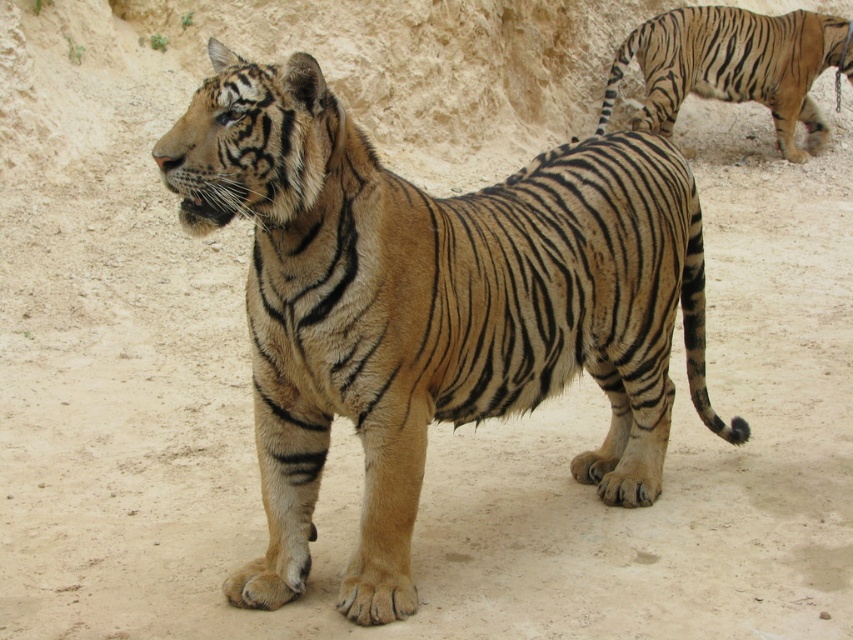
You are a zookeeper who needs to observe both tigers. You are currently standing near the golden fur tiger at center. Which direction should you move to get a better view of the striped fur tiger at upper right?

You should move towards the upper right direction to get a better view of the striped fur tiger at upper right since it is located in that direction and is further away from you compared to the golden fur tiger at center.

You are a zookeeper trying to locate two points in the enclosure. The first point is at point [735,442] and the second point is at point [788,88]. Which point is nearer to the camera?

Point [735,442] is closer to the camera than point [788,88].

You are a zookeeper planning to feed both the golden fur tiger at center and the striped fur tiger at upper right. If you have a limited amount of meat, which tiger should you give more food to based on their sizes?

The golden fur tiger at center has a larger size compared to the striped fur tiger at upper right, so you should give more food to the golden fur tiger at center.